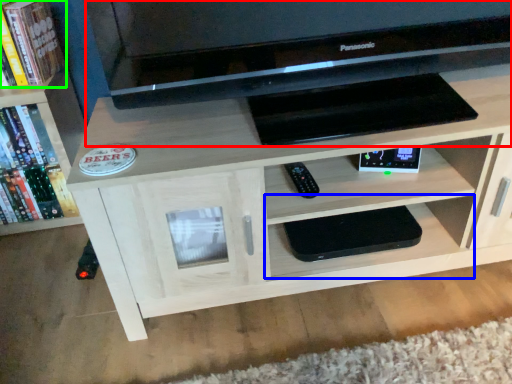
Question: Which object is positioned closest to computer (highlighted by a red box)? Select from shelf (highlighted by a blue box) and book (highlighted by a green box).

Choices:
 (A) shelf
 (B) book

Answer: (A)